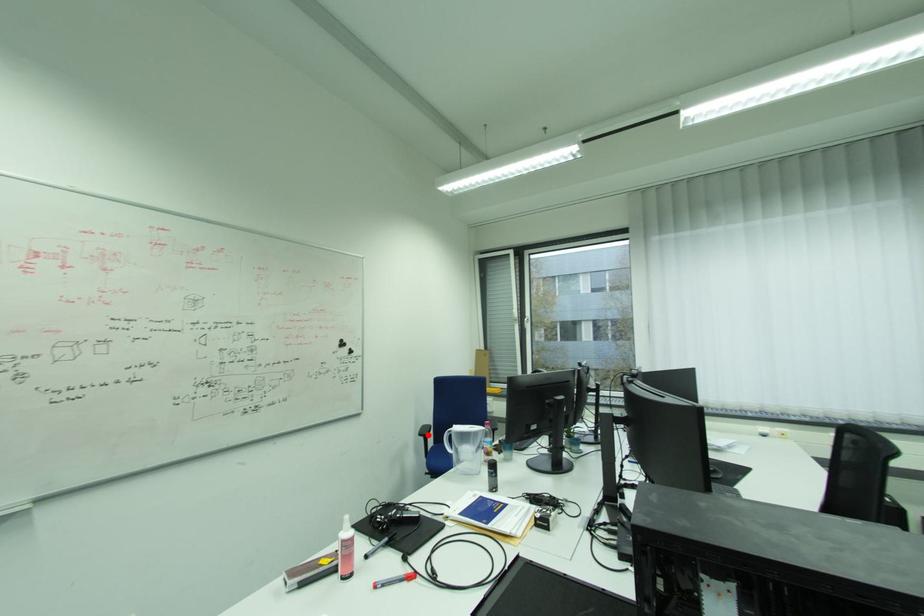
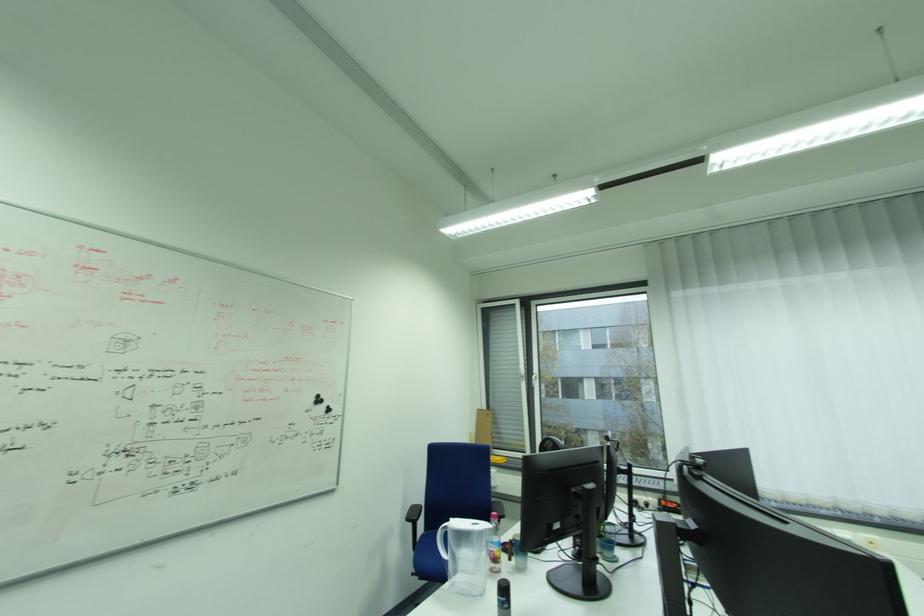
Find the pixel in the second image that matches the highlighted location in the first image.

(415, 521)